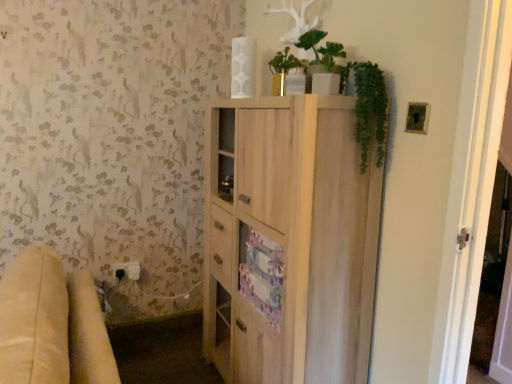
Question: Is green matte plant at upper center outside beige fabric couch at lower left?

Choices:
 (A) no
 (B) yes

Answer: (B)

Question: From the image's perspective, does green matte plant at upper center appear lower than beige fabric couch at lower left?

Choices:
 (A) yes
 (B) no

Answer: (B)

Question: Does green matte plant at upper center touch beige fabric couch at lower left?

Choices:
 (A) yes
 (B) no

Answer: (B)

Question: Is beige fabric couch at lower left a part of green matte plant at upper center?

Choices:
 (A) no
 (B) yes

Answer: (A)

Question: Can you confirm if green matte plant at upper center is smaller than beige fabric couch at lower left?

Choices:
 (A) no
 (B) yes

Answer: (B)

Question: Considering the positions of white plastic electric outlet at lower left and green matte plant at upper center in the image, is white plastic electric outlet at lower left bigger or smaller than green matte plant at upper center?

Choices:
 (A) big
 (B) small

Answer: (B)

Question: Does point (120, 264) appear closer or farther from the camera than point (318, 59)?

Choices:
 (A) closer
 (B) farther

Answer: (B)

Question: In the image, is white plastic electric outlet at lower left on the left side or the right side of green matte plant at upper center?

Choices:
 (A) left
 (B) right

Answer: (A)

Question: Considering the positions of white plastic electric outlet at lower left and green matte plant at upper center in the image, is white plastic electric outlet at lower left wider or thinner than green matte plant at upper center?

Choices:
 (A) wide
 (B) thin

Answer: (B)

Question: From the image's perspective, relative to green matte plant at upper center, is light wood cabinet at center above or below?

Choices:
 (A) above
 (B) below

Answer: (B)

Question: Does point (287, 130) appear closer or farther from the camera than point (302, 41)?

Choices:
 (A) closer
 (B) farther

Answer: (A)

Question: Looking at the image, does light wood cabinet at center seem bigger or smaller compared to green matte plant at upper center?

Choices:
 (A) small
 (B) big

Answer: (B)

Question: Do you think light wood cabinet at center is within green matte plant at upper center, or outside of it?

Choices:
 (A) inside
 (B) outside

Answer: (B)

Question: Is green matte plant at upper center in front of or behind white plastic electric outlet at lower left in the image?

Choices:
 (A) behind
 (B) front

Answer: (B)

Question: From a real-world perspective, relative to white plastic electric outlet at lower left, is green matte plant at upper center vertically above or below?

Choices:
 (A) below
 (B) above

Answer: (B)